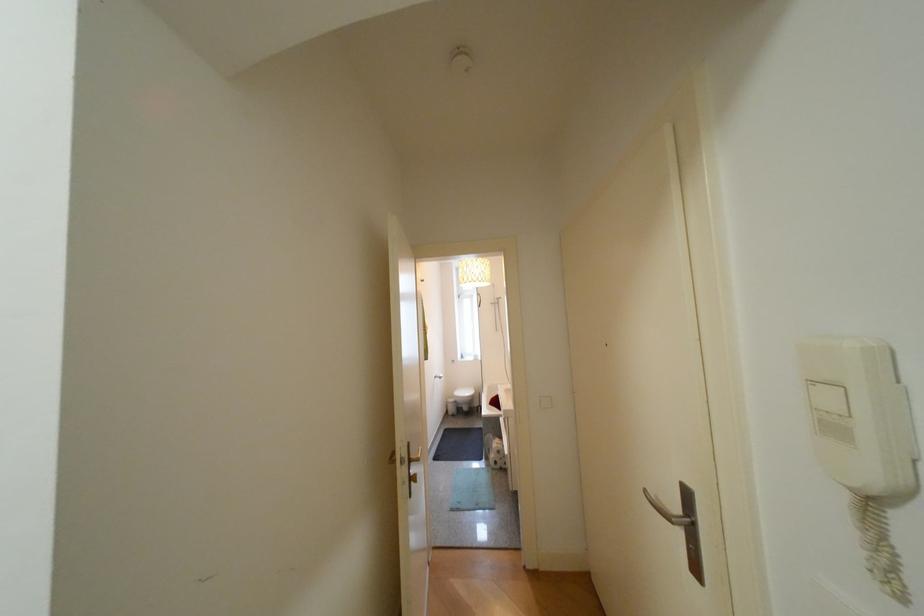
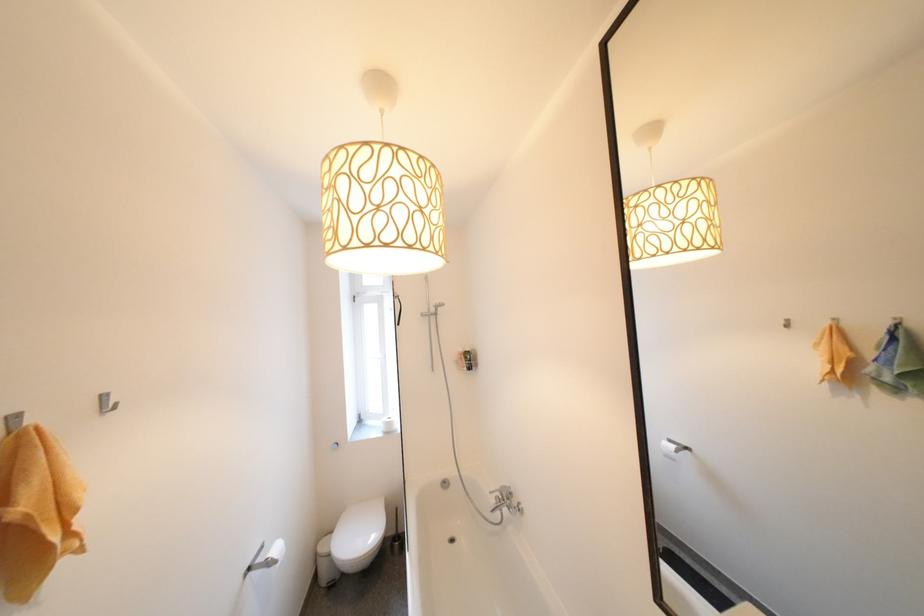
In the second image, find the point that corresponds to the point at 456,411 in the first image.

(325, 578)